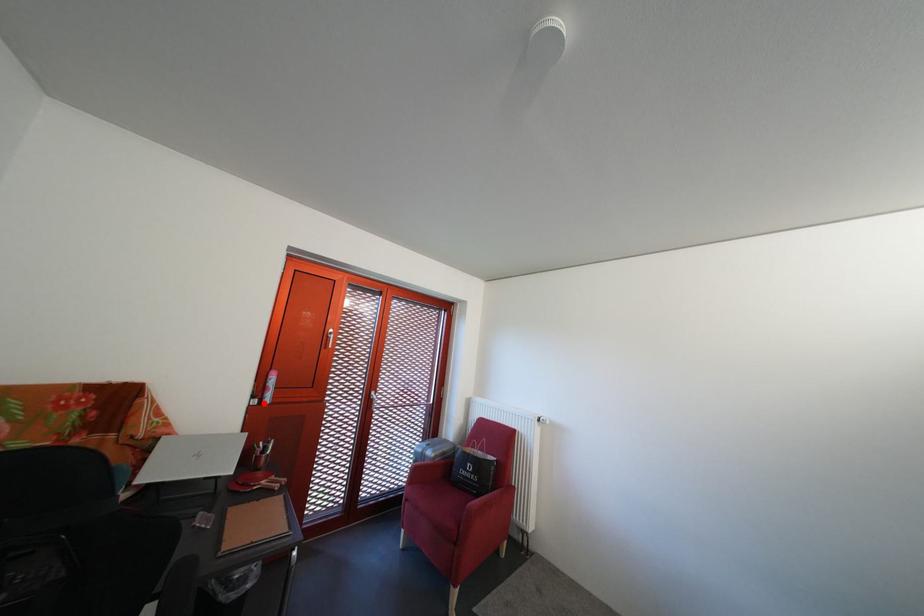
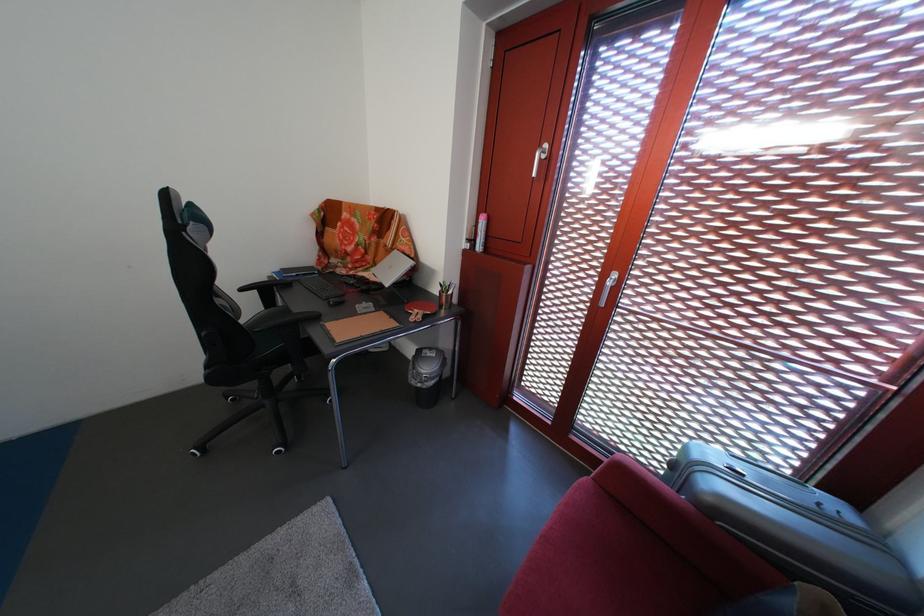
Locate, in the second image, the point that corresponds to the highlighted location in the first image.

(479, 246)